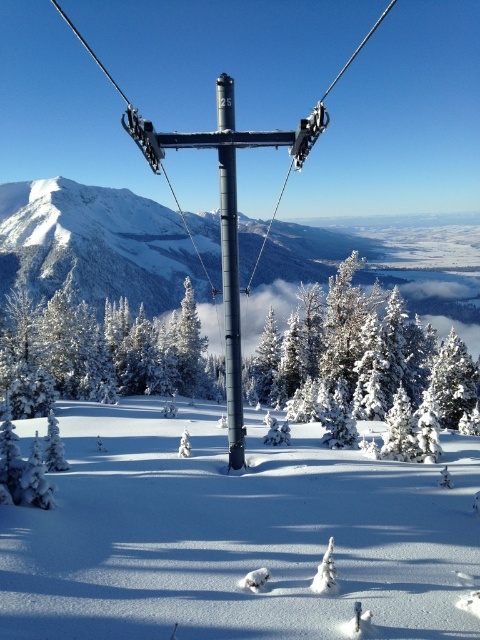
Between point (348, 518) and point (239, 365), which one is positioned in front?

Point (348, 518) is in front.

Is white snow at center bigger than metallic pole at center?

No, white snow at center is not bigger than metallic pole at center.

Is point (118, 417) behind point (225, 131)?

Yes, point (118, 417) is behind point (225, 131).

Where is `white snow at center`? white snow at center is located at coordinates (233, 534).